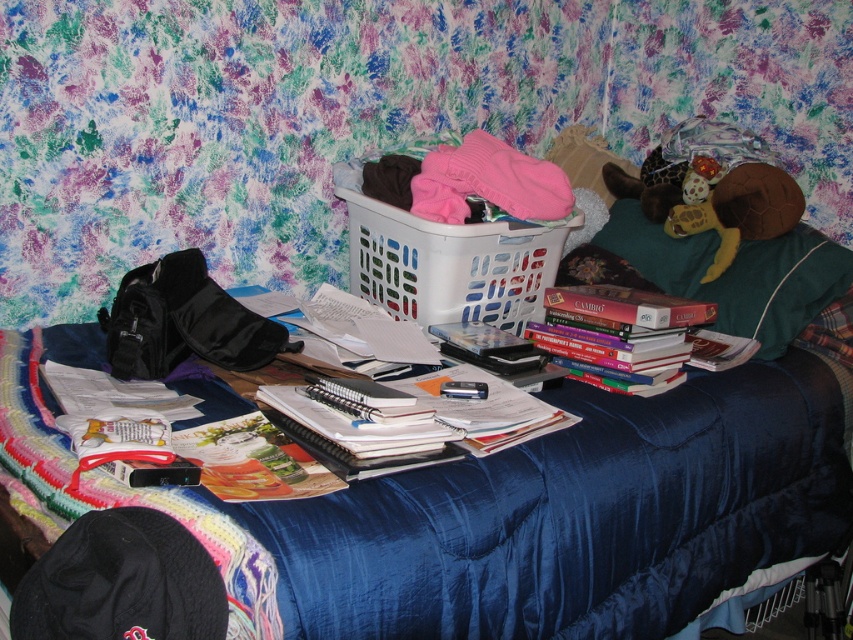
You are standing in the bedroom and want to pick up an item from the bed. There are two points marked on the bed surface. The first point is at coordinates point (830, 294) and the second is at point (663, 376). Which point is closer to you?

Point (830, 294) is further to the camera than point (663, 376), so the second point is closer to you.

You need to place a new item on the bed. The item is larger than the hardcover books at center but smaller than the white plastic laundry basket at center. Where on the bed can you place it without overlapping any existing items?

The item can be placed on the left side of the bed near the black backpack lying open, as there is space available there that is not occupied by the white plastic laundry basket at center or the hardcover books at center.

You are organizing the items on the bed. If you want to reach the hardcover books at center without moving the white plastic laundry basket at center, where should you move to?

The hardcover books at center are located behind the white plastic laundry basket at center, so you should move to the back side of the bed to access them without moving the basket.